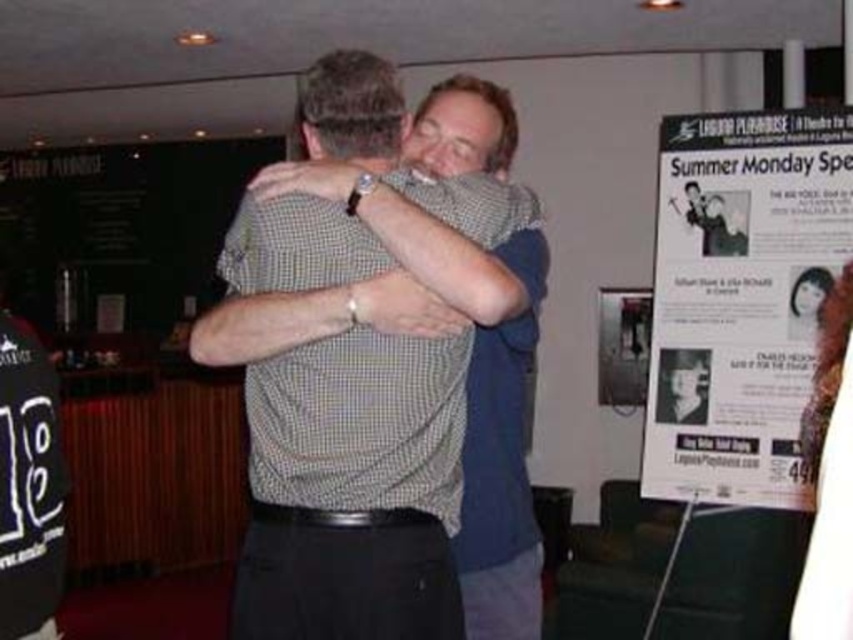
You are an event organizer who needs to ensure that all attendees can see the white paper poster at right clearly. Given that the checkered fabric shirt at center is blocking part of the poster, can you estimate how much of the poster remains visible?

The checkered fabric shirt at center is smaller than the white paper poster at right, so part of the poster is still visible. The exact amount isn